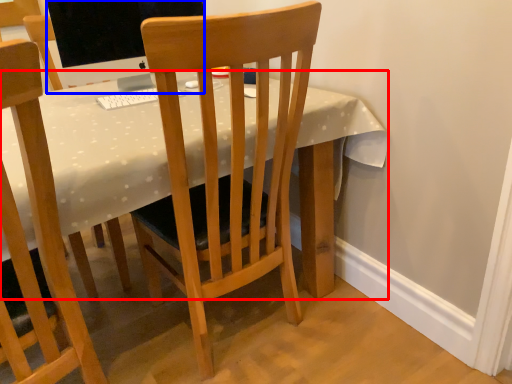
Question: Which of the following is the farthest to the observer, desk (highlighted by a red box) or television (highlighted by a blue box)?

Choices:
 (A) desk
 (B) television

Answer: (B)